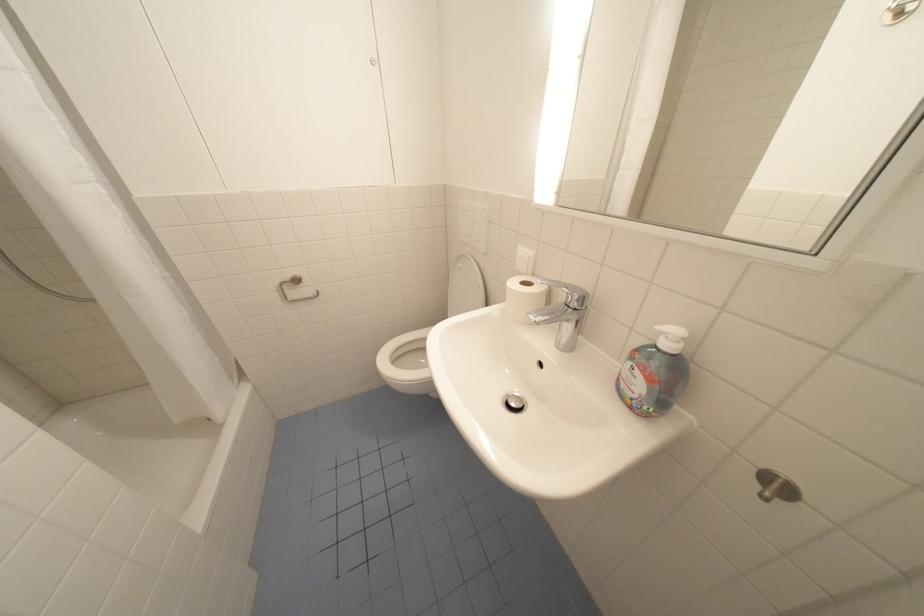
The width and height of the screenshot is (924, 616). Describe the element at coordinates (524, 297) in the screenshot. I see `a toilet paper roll` at that location.